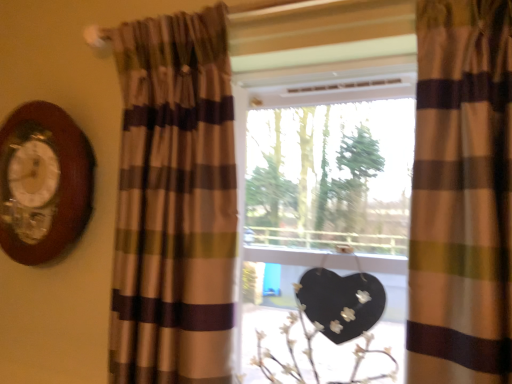
You are a GUI agent. You are given a task and a screenshot of the screen. Output one action in this format:
    pyautogui.click(x=<x>, y=<y>)
    Task: Click on the white matte floral arrangement at center
    The image size is (512, 384).
    Given the screenshot: What is the action you would take?
    pyautogui.click(x=316, y=351)

What do you see at coordinates (316, 351) in the screenshot? I see `white matte floral arrangement at center` at bounding box center [316, 351].

This screenshot has height=384, width=512. I want to click on wooden clock at left, so click(42, 183).

Which curtain is the 1st one when counting from the right side of the wooden clock at left? Please provide its 2D coordinates.

[(174, 202)]

From the image's perspective, between brown striped curtain at left, marked as the second curtain in a right-to-left arrangement, and wooden clock at left, who is located below?

brown striped curtain at left, marked as the second curtain in a right-to-left arrangement, from the image's perspective.

Can you tell me how much brown striped curtain at left, which is the first curtain in left-to-right order, and wooden clock at left differ in facing direction?

The facing directions of brown striped curtain at left, which is the first curtain in left-to-right order, and wooden clock at left are 0.973 degrees apart.

Does brown striped curtain at left, which is the first curtain in left-to-right order, appear on the left side of wooden clock at left?

Incorrect, brown striped curtain at left, which is the first curtain in left-to-right order, is not on the left side of wooden clock at left.

Which object is thinner, wooden clock at left or matte glass window at center?

wooden clock at left is thinner.

From the image's perspective, which is above, wooden clock at left or matte glass window at center?

wooden clock at left appears higher in the image.

Is wooden clock at left oriented towards matte glass window at center?

No, wooden clock at left is not turned towards matte glass window at center.

Are matte glass window at center and brown striped curtain at right, the 2th curtain from the left, far apart?

No, matte glass window at center is in close proximity to brown striped curtain at right, the 2th curtain from the left.

Considering the positions of objects matte glass window at center and brown striped curtain at right, acting as the first curtain starting from the right, in the image provided, who is more to the left, matte glass window at center or brown striped curtain at right, acting as the first curtain starting from the right,?

Positioned to the left is matte glass window at center.

Does point (391, 295) come behind point (510, 21)?

Yes, point (391, 295) is farther from viewer.

Considering the relative sizes of matte glass window at center and brown striped curtain at right, the 2th curtain from the left, in the image provided, is matte glass window at center thinner than brown striped curtain at right, the 2th curtain from the left,?

Indeed, matte glass window at center has a lesser width compared to brown striped curtain at right, the 2th curtain from the left.

Which object is positioned more to the left, brown striped curtain at right, the 2th curtain from the left, or brown striped curtain at left, marked as the second curtain in a right-to-left arrangement?

brown striped curtain at left, marked as the second curtain in a right-to-left arrangement.

Is brown striped curtain at right, the 2th curtain from the left, in contact with brown striped curtain at left, which is the first curtain in left-to-right order?

There is a gap between brown striped curtain at right, the 2th curtain from the left, and brown striped curtain at left, which is the first curtain in left-to-right order.

Is brown striped curtain at right, the 2th curtain from the left, surrounding brown striped curtain at left, which is the first curtain in left-to-right order?

No, brown striped curtain at left, which is the first curtain in left-to-right order, is not surrounded by brown striped curtain at right, the 2th curtain from the left.

From a real-world perspective, relative to brown striped curtain at left, which is the first curtain in left-to-right order, is brown striped curtain at right, the 2th curtain from the left, vertically above or below?

brown striped curtain at right, the 2th curtain from the left, is situated higher than brown striped curtain at left, which is the first curtain in left-to-right order, in the real world.

Looking at this image, is brown striped curtain at right, the 2th curtain from the left, turned away from white matte floral arrangement at center?

No, brown striped curtain at right, the 2th curtain from the left,'s orientation is not away from white matte floral arrangement at center.

Considering the relative positions of brown striped curtain at right, the 2th curtain from the left, and white matte floral arrangement at center in the image provided, is brown striped curtain at right, the 2th curtain from the left, to the right of white matte floral arrangement at center from the viewer's perspective?

Correct, you'll find brown striped curtain at right, the 2th curtain from the left, to the right of white matte floral arrangement at center.

How distant is brown striped curtain at right, acting as the first curtain starting from the right, from white matte floral arrangement at center?

brown striped curtain at right, acting as the first curtain starting from the right, is 17.17 inches away from white matte floral arrangement at center.

From the image's perspective, is brown striped curtain at right, acting as the first curtain starting from the right, above or below white matte floral arrangement at center?

Based on their image positions, brown striped curtain at right, acting as the first curtain starting from the right, is located above white matte floral arrangement at center.

Considering the sizes of wooden clock at left and brown striped curtain at left, which is the first curtain in left-to-right order, in the image, is wooden clock at left taller or shorter than brown striped curtain at left, which is the first curtain in left-to-right order,?

In the image, wooden clock at left appears to be shorter than brown striped curtain at left, which is the first curtain in left-to-right order.

Locate an element on the screen. clock on the left of brown striped curtain at left, which is the first curtain in left-to-right order is located at coordinates (42, 183).

From the image's perspective, which is above, wooden clock at left or brown striped curtain at left, which is the first curtain in left-to-right order?

wooden clock at left is shown above in the image.

Can you confirm if wooden clock at left is positioned to the right of brown striped curtain at left, marked as the second curtain in a right-to-left arrangement?

In fact, wooden clock at left is to the left of brown striped curtain at left, marked as the second curtain in a right-to-left arrangement.

In terms of width, does wooden clock at left look wider or thinner when compared to brown striped curtain at right, the 2th curtain from the left?

Considering their sizes, wooden clock at left looks slimmer than brown striped curtain at right, the 2th curtain from the left.

Is wooden clock at left aimed at brown striped curtain at right, the 2th curtain from the left?

No, wooden clock at left is not turned towards brown striped curtain at right, the 2th curtain from the left.

Based on the photo, does wooden clock at left have a smaller size compared to brown striped curtain at right, the 2th curtain from the left?

Correct, wooden clock at left occupies less space than brown striped curtain at right, the 2th curtain from the left.

From the image's perspective, count 2nd curtains downward from the wooden clock at left and point to it. Please provide its 2D coordinates.

[(174, 202)]

Identify the location of window that is on the right side of wooden clock at left. [x=326, y=173].

Which object lies further to the anchor point wooden clock at left, white matte floral arrangement at center or matte glass window at center?

Based on the image, white matte floral arrangement at center appears to be further to wooden clock at left.

Considering their positions, is white matte floral arrangement at center positioned further to matte glass window at center than brown striped curtain at right, acting as the first curtain starting from the right?

Among the two, brown striped curtain at right, acting as the first curtain starting from the right, is located further to matte glass window at center.

Based on their spatial positions, is wooden clock at left or brown striped curtain at left, which is the first curtain in left-to-right order, further from brown striped curtain at right, acting as the first curtain starting from the right?

Based on the image, wooden clock at left appears to be further to brown striped curtain at right, acting as the first curtain starting from the right.

Which object lies nearer to the anchor point white matte floral arrangement at center, wooden clock at left or brown striped curtain at left, marked as the second curtain in a right-to-left arrangement?

brown striped curtain at left, marked as the second curtain in a right-to-left arrangement, is closer to white matte floral arrangement at center.

Consider the image. Estimate the real-world distances between objects in this image. Which object is further from wooden clock at left, brown striped curtain at left, marked as the second curtain in a right-to-left arrangement, or matte glass window at center?

Based on the image, matte glass window at center appears to be further to wooden clock at left.

Looking at the image, which one is located closer to brown striped curtain at left, marked as the second curtain in a right-to-left arrangement, brown striped curtain at right, acting as the first curtain starting from the right, or matte glass window at center?

matte glass window at center is closer to brown striped curtain at left, marked as the second curtain in a right-to-left arrangement.

When comparing their distances from brown striped curtain at right, acting as the first curtain starting from the right, does white matte floral arrangement at center or matte glass window at center seem further?

matte glass window at center is further to brown striped curtain at right, acting as the first curtain starting from the right.

Estimate the real-world distances between objects in this image. Which object is further from white matte floral arrangement at center, brown striped curtain at left, which is the first curtain in left-to-right order, or wooden clock at left?

wooden clock at left lies further to white matte floral arrangement at center than the other object.

The image size is (512, 384). Find the location of `floral arrangement located between brown striped curtain at left, marked as the second curtain in a right-to-left arrangement, and brown striped curtain at right, the 2th curtain from the left, in the left-right direction`. floral arrangement located between brown striped curtain at left, marked as the second curtain in a right-to-left arrangement, and brown striped curtain at right, the 2th curtain from the left, in the left-right direction is located at coordinates (316, 351).

Where is `window between brown striped curtain at left, marked as the second curtain in a right-to-left arrangement, and brown striped curtain at right, the 2th curtain from the left`? Image resolution: width=512 pixels, height=384 pixels. window between brown striped curtain at left, marked as the second curtain in a right-to-left arrangement, and brown striped curtain at right, the 2th curtain from the left is located at coordinates (326, 173).

You are a GUI agent. You are given a task and a screenshot of the screen. Output one action in this format:
    pyautogui.click(x=<x>, y=<y>)
    Task: Click on the window between wooden clock at left and brown striped curtain at right, acting as the first curtain starting from the right, in the horizontal direction
    This screenshot has width=512, height=384.
    Given the screenshot: What is the action you would take?
    pyautogui.click(x=326, y=173)

Locate an element on the screen. curtain between wooden clock at left and white matte floral arrangement at center in the horizontal direction is located at coordinates (174, 202).